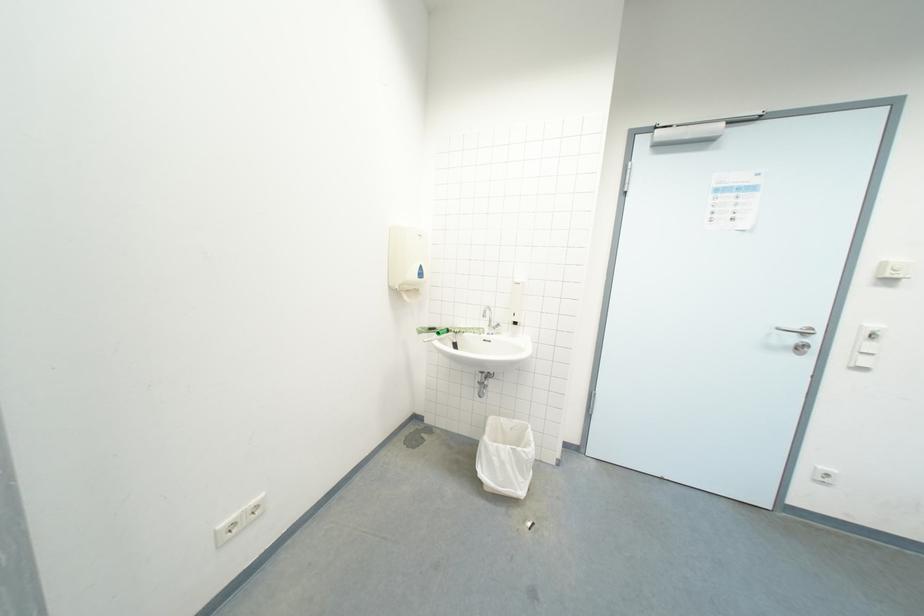
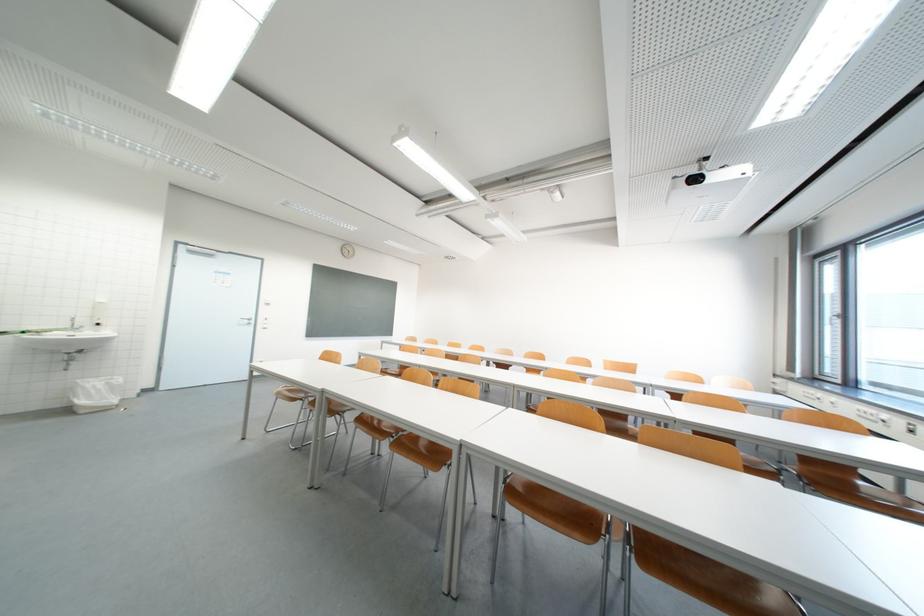
Locate, in the second image, the point that corresponds to pixel 492 475 in the first image.

(91, 403)